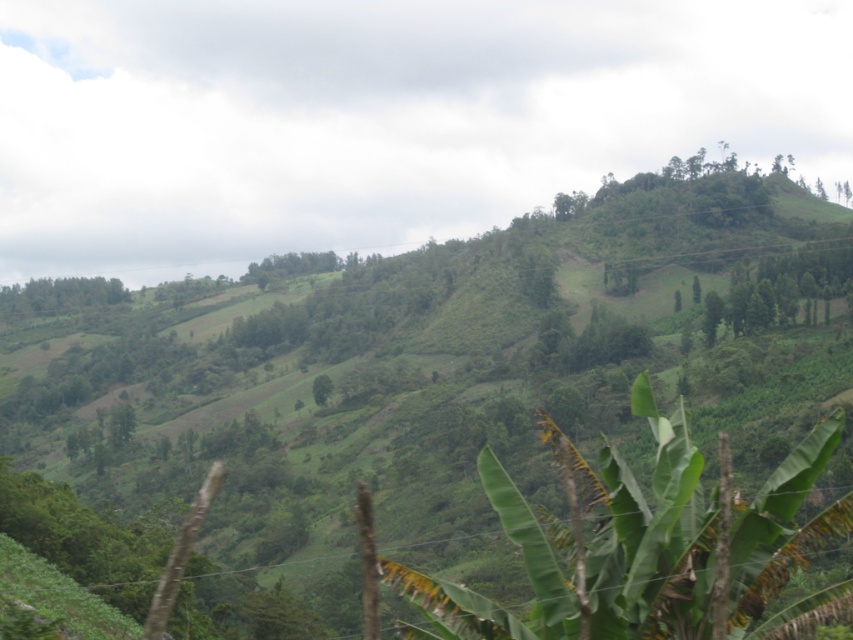
You are a gardener planning to plant a new row of plants between the green leafy banana tree at center and the green leafy trees at left. Which of the two has a narrower width to consider for spacing?

The green leafy banana tree at center has a narrower width compared to the green leafy trees at left, so you should consider its width for spacing.

You are standing in a lush green landscape with rolling hills and dense vegetation. You see a point marked at coordinates [592,548]. What object is located at that point?

The green leafy banana tree at center is located at point [592,548].